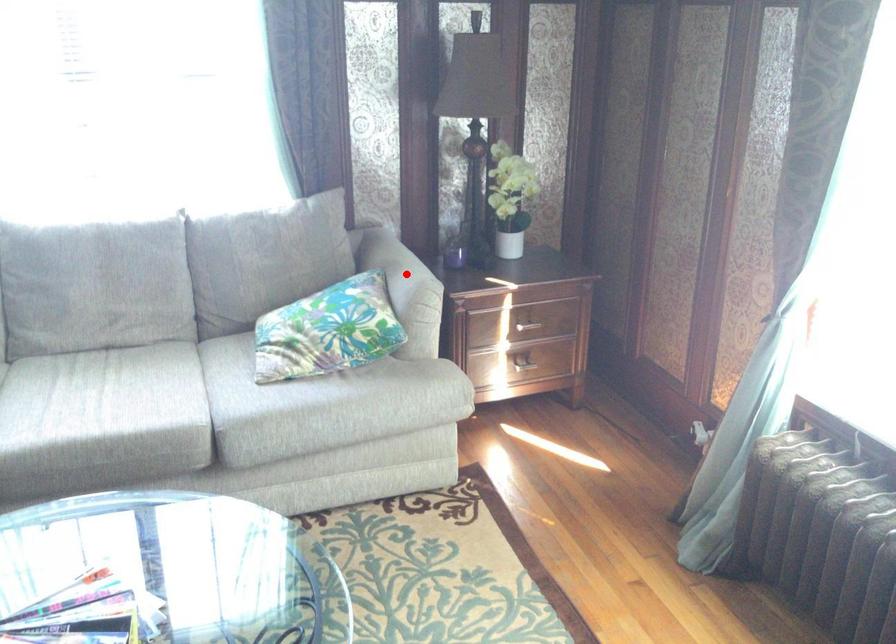
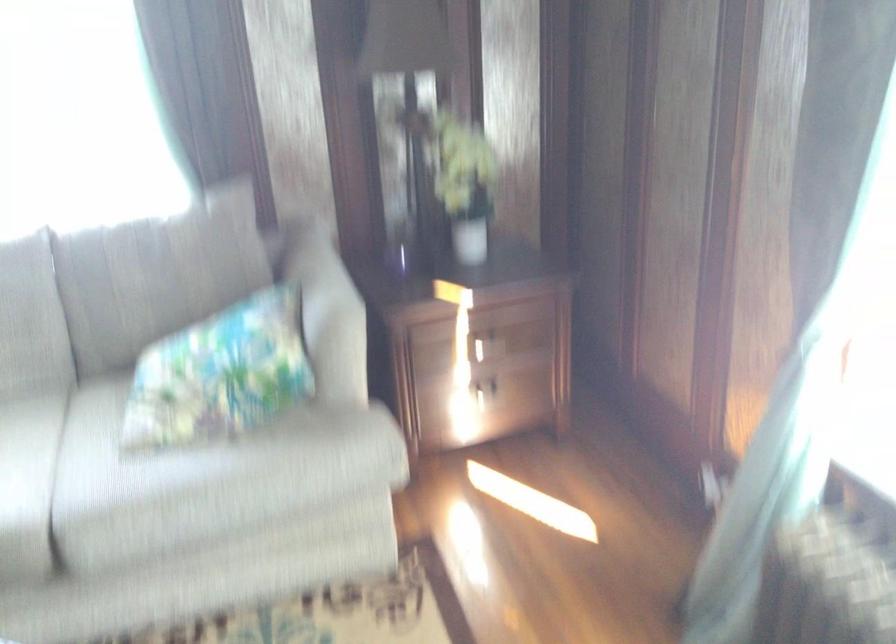
Question: I am providing you with two images of the same scene from different viewpoints. In image1, a red point is highlighted. Considering the same 3D point in image2, which of the following is correct?

Choices:
 (A) It is closer
 (B) It is farther

Answer: (A)